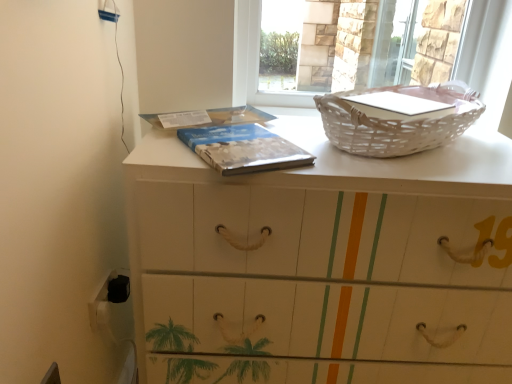
Question: In the image, is blue textured book at center positioned in front of or behind white wicker basket at upper right?

Choices:
 (A) front
 (B) behind

Answer: (A)

Question: Does point (263, 165) appear closer or farther from the camera than point (496, 11)?

Choices:
 (A) farther
 (B) closer

Answer: (B)

Question: Which of these objects is positioned closest to the white wicker basket at upper right?

Choices:
 (A) blue textured book at center
 (B) white wicker basket at upper right
 (C) white painted wood chest of drawers at center
 (D) transparent glass screen door at upper center

Answer: (B)

Question: Which of these objects is positioned farthest from the white painted wood chest of drawers at center?

Choices:
 (A) blue textured book at center
 (B) white wicker basket at upper right
 (C) white wicker basket at upper right
 (D) transparent glass screen door at upper center

Answer: (D)